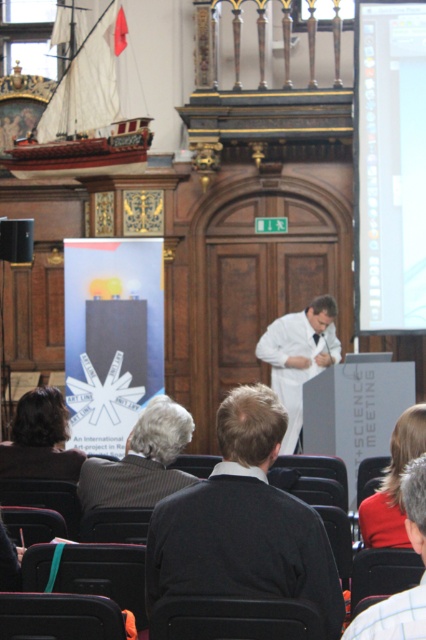
You are an attendee in the lecture hall and want to see both the wooden ship at upper left and the white smooth coat at center clearly. Which object is higher in the image?

The wooden ship at upper left is positioned over the white smooth coat at center, so it is higher in the image.

You are an attendee in the lecture hall and want to see the wooden ship at upper left and the white smooth coat at center. Which object is taller?

The wooden ship at upper left is taller than the white smooth coat at center.

You are a guest speaker at the T Science Meeting. You need to walk from the wooden ship at upper left to the white shirt at center. Can you make it in 10 seconds?

The distance between wooden ship at upper left and white shirt at center is 99.29 feet. Assuming a normal walking speed of 3 feet per second, it would take approximately 33 seconds. Therefore, you cannot make it in 10 seconds.